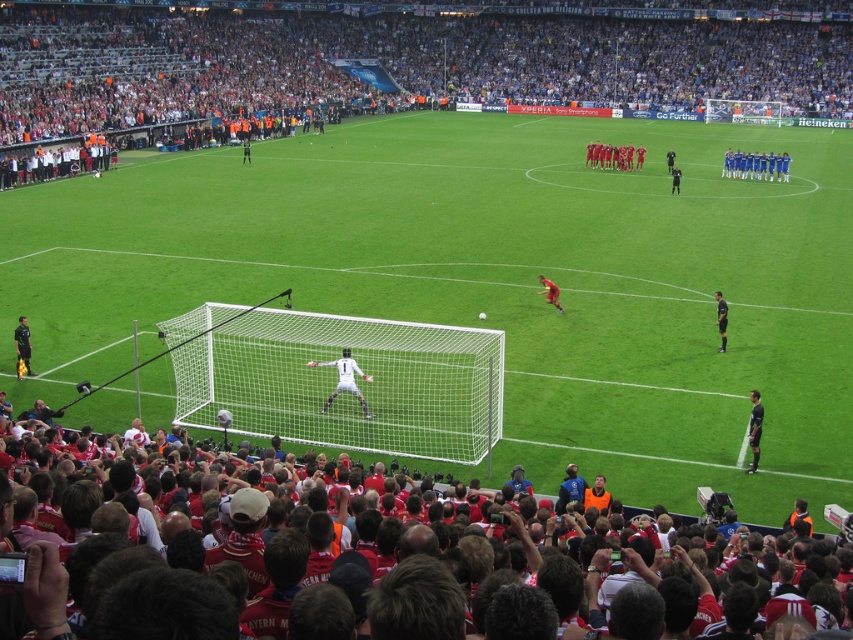
Consider the image. Between red jersey crowd at lower left and black uniformed person at center, which one has more height?

red jersey crowd at lower left

Is point (561, 442) behind point (718, 317)?

No, it is not.

At what (x,y) coordinates should I click in order to perform the action: click on red jersey crowd at lower left. Please return your answer as a coordinate pair (x, y). Looking at the image, I should click on (683, 444).

Is point (27, 356) positioned behind point (718, 349)?

That is False.

Is point (30, 348) positioned before point (724, 326)?

Yes.

Which is in front, point (20, 342) or point (717, 321)?

Positioned in front is point (20, 342).

At what (x,y) coordinates should I click in order to perform the action: click on black uniformed person at lower left. Please return your answer as a coordinate pair (x, y). The image size is (853, 640). Looking at the image, I should click on (22, 342).

Which is below, red jersey crowd at lower left or black uniform at center?

red jersey crowd at lower left is below.

Is red jersey crowd at lower left to the right of black uniform at center from the viewer's perspective?

In fact, red jersey crowd at lower left is to the left of black uniform at center.

Does point (772, 452) lie behind point (672, 179)?

That is False.

Identify the location of red jersey crowd at lower left. (683, 444).